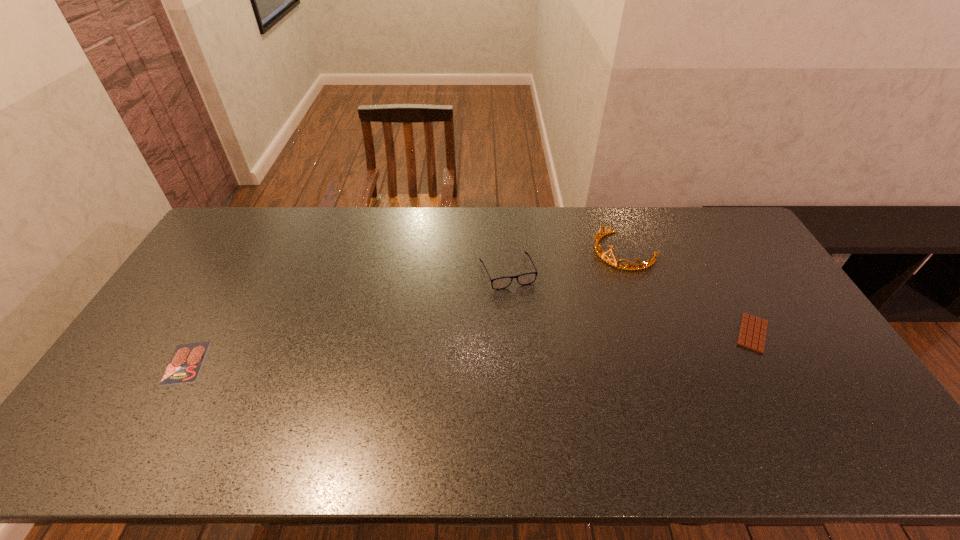
At what (x,y) coordinates should I click in order to perform the action: click on vacant area situated 0.280m on the front-facing side of the tallest object. Please return your answer as a coordinate pair (x, y). The height and width of the screenshot is (540, 960). Looking at the image, I should click on (553, 308).

This screenshot has height=540, width=960. Find the location of `free location located on the front-facing side of the tallest object`. free location located on the front-facing side of the tallest object is located at coordinates (549, 312).

This screenshot has width=960, height=540. In order to click on vacant region located 0.200m on the front-facing side of the tallest object in this screenshot , I will do `click(569, 295)`.

The width and height of the screenshot is (960, 540). Identify the location of vacant space located 0.100m on the front-facing side of the spectacles. (525, 314).

Where is `vacant space located on the front-facing side of the spectacles`? This screenshot has height=540, width=960. vacant space located on the front-facing side of the spectacles is located at coordinates (529, 321).

Where is `vacant space located 0.190m on the front-facing side of the spectacles`? Image resolution: width=960 pixels, height=540 pixels. vacant space located 0.190m on the front-facing side of the spectacles is located at coordinates (535, 336).

Find the location of a particular element. The width and height of the screenshot is (960, 540). object that is at the far edge is located at coordinates (601, 255).

The width and height of the screenshot is (960, 540). I want to click on object located in the left edge section of the desktop, so click(184, 366).

Locate an element on the screen. The width and height of the screenshot is (960, 540). object that is positioned at the right edge is located at coordinates (752, 335).

Locate an element on the screen. free region at the far edge of the desktop is located at coordinates (309, 208).